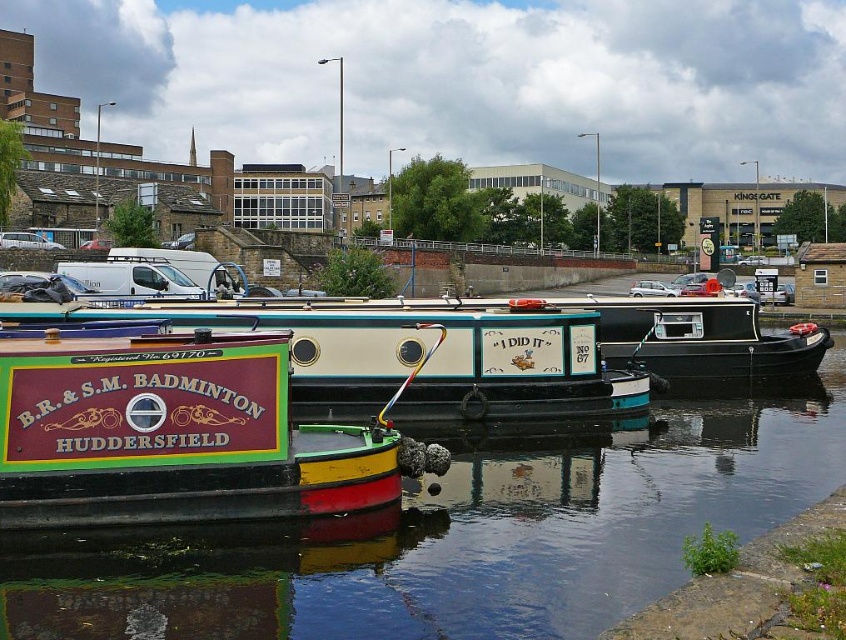
Which is more to the right, maroon painted wood boat at lower left or maroon painted wood boat at center?

maroon painted wood boat at center is more to the right.

Is point (286, 435) behind point (364, 332)?

That is False.

You are a GUI agent. You are given a task and a screenshot of the screen. Output one action in this format:
    pyautogui.click(x=<x>, y=<y>)
    Task: Click on the maroon painted wood boat at lower left
    This screenshot has height=640, width=846.
    Given the screenshot: What is the action you would take?
    pyautogui.click(x=174, y=433)

Does smooth black water at center have a greater width compared to maroon painted wood boat at center?

Correct, the width of smooth black water at center exceeds that of maroon painted wood boat at center.

Is point (657, 592) positioned behind point (534, 419)?

That is False.

Image resolution: width=846 pixels, height=640 pixels. Find the location of `smooth black water at center`. smooth black water at center is located at coordinates (454, 540).

Locate an element on the screen. The image size is (846, 640). smooth black water at center is located at coordinates (454, 540).

Is smooth black water at center wider than maroon painted wood boat at lower left?

Correct, the width of smooth black water at center exceeds that of maroon painted wood boat at lower left.

Image resolution: width=846 pixels, height=640 pixels. In order to click on smooth black water at center in this screenshot , I will do `click(454, 540)`.